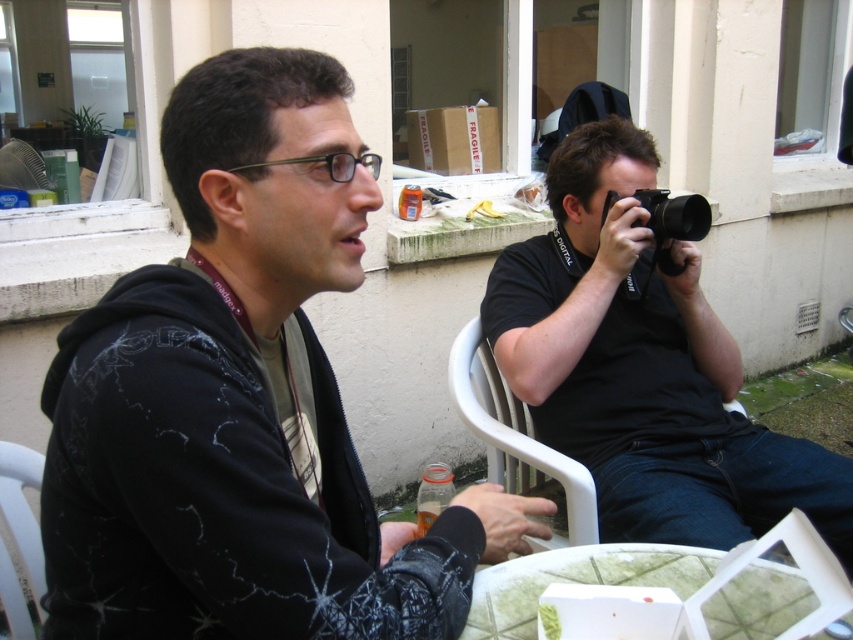
Does point (160, 577) come farther from viewer compared to point (604, 561)?

No, (160, 577) is closer to viewer.

Is black matte hoodie at center to the right of white glass table at lower center from the viewer's perspective?

Incorrect, black matte hoodie at center is not on the right side of white glass table at lower center.

Measure the distance between point (204,134) and camera.

The distance of point (204,134) from camera is 31.55 inches.

Identify the location of black matte hoodie at center. (241, 403).

Who is positioned more to the left, white glass table at lower center or white plastic chair at center?

From the viewer's perspective, white plastic chair at center appears more on the left side.

Which is in front, point (717, 612) or point (521, 428)?

Point (717, 612) is in front.

Identify the location of white glass table at lower center. (577, 580).

Can you confirm if black matte camera at center is bigger than white glass table at lower center?

Yes, black matte camera at center is bigger than white glass table at lower center.

Who is positioned more to the right, black matte camera at center or white glass table at lower center?

black matte camera at center is more to the right.

This screenshot has width=853, height=640. Find the location of `black matte camera at center`. black matte camera at center is located at coordinates (643, 368).